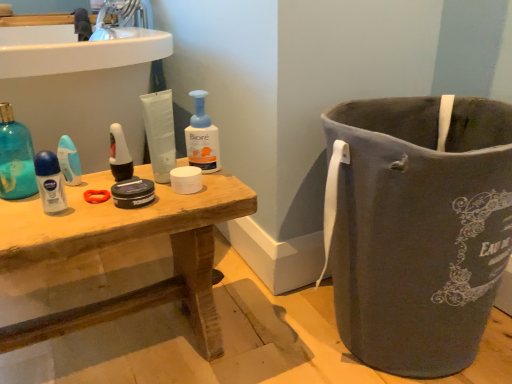
Question: Considering the positions of wooden table at center and translucent plastic deodorant stick at left, which ranks as the 2th cleaning product in right-to-left order, in the image, is wooden table at center taller or shorter than translucent plastic deodorant stick at left, which ranks as the 2th cleaning product in right-to-left order,?

Choices:
 (A) tall
 (B) short

Answer: (A)

Question: From a real-world perspective, is wooden table at center positioned above or below translucent plastic deodorant stick at left, which ranks as the 1th cleaning product in left-to-right order?

Choices:
 (A) above
 (B) below

Answer: (B)

Question: Estimate the real-world distances between objects in this image. Which object is farther from the blue plastic razor at center?

Choices:
 (A) white matte toothbrush at center
 (B) wooden table at center
 (C) white glossy sink at upper left
 (D) matte white shaving cream at left
 (E) white matte toilet paper at center

Answer: (B)

Question: Which is nearer to the white matte toilet paper at center?

Choices:
 (A) blue plastic razor at center
 (B) matte white shaving cream at left
 (C) wooden table at center
 (D) translucent plastic deodorant stick at left, which ranks as the 1th cleaning product in left-to-right order
 (E) translucent plastic pump bottle at center, which ranks as the second cleaning product in left-to-right order

Answer: (E)